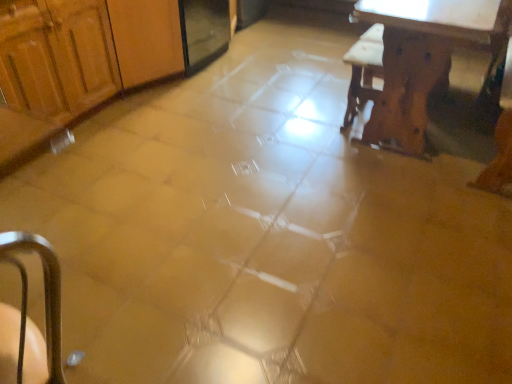
You are a GUI agent. You are given a task and a screenshot of the screen. Output one action in this format:
    pyautogui.click(x=<x>, y=<y>)
    Task: Click on the vacant area that is in front of wooden table at upper right
    
    Given the screenshot: What is the action you would take?
    pyautogui.click(x=400, y=215)